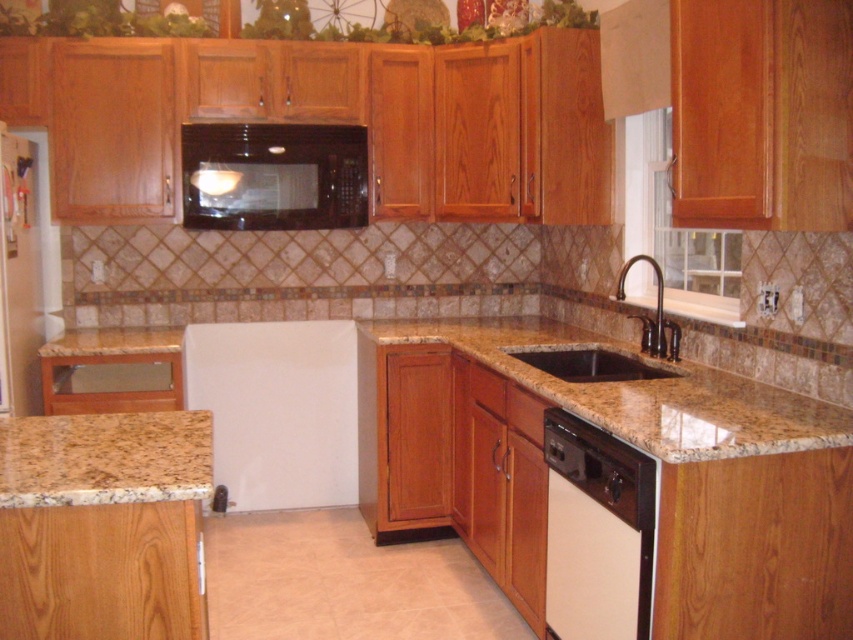
Question: Estimate the real-world distances between objects in this image. Which object is closer to the oil rubbed bronze faucet at upper right?

Choices:
 (A) granite countertop at lower left
 (B) granite sink at lower right
 (C) brown granite countertop at lower left
 (D) white glossy dishwasher at lower center

Answer: (B)

Question: Which point is closer to the camera?

Choices:
 (A) (556, 369)
 (B) (671, 372)

Answer: (B)

Question: Can you confirm if brown granite countertop at lower left is thinner than black glossy microwave at upper center?

Choices:
 (A) no
 (B) yes

Answer: (B)

Question: Can you confirm if brown granite countertop at lower left is bigger than granite sink at lower right?

Choices:
 (A) no
 (B) yes

Answer: (B)

Question: Which point is closer to the camera?

Choices:
 (A) (128, 428)
 (B) (654, 326)
 (C) (544, 356)
 (D) (838, 419)

Answer: (A)

Question: Is granite countertop at lower left below granite sink at lower right?

Choices:
 (A) no
 (B) yes

Answer: (B)